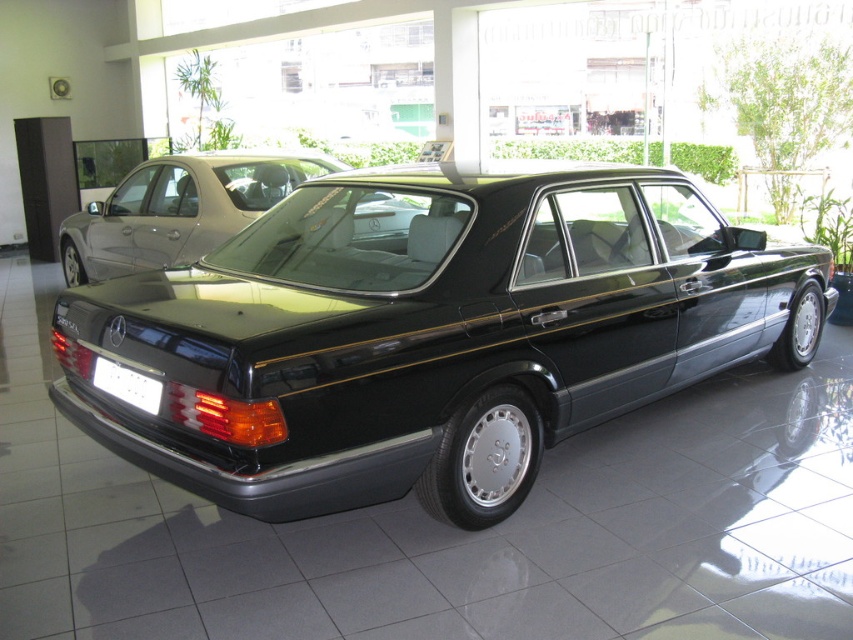
Is point (165, 323) closer to camera compared to point (62, 256)?

Yes, it is in front of point (62, 256).

Looking at this image, between glossy black car at center and glossy black sedan at center, which one has less height?

Standing shorter between the two is glossy black sedan at center.

At what (x,y) coordinates should I click in order to perform the action: click on glossy black car at center. Please return your answer as a coordinate pair (x, y). Image resolution: width=853 pixels, height=640 pixels. Looking at the image, I should click on (428, 332).

Does glossy black car at center have a lesser width compared to white plastic license plate at rear?

In fact, glossy black car at center might be wider than white plastic license plate at rear.

Between point (778, 292) and point (155, 394), which one is positioned in front?

Point (155, 394) is in front.

Locate an element on the screen. This screenshot has width=853, height=640. glossy black car at center is located at coordinates [x=428, y=332].

Which of these two, glossy black sedan at center or white plastic license plate at rear, stands taller?

Standing taller between the two is glossy black sedan at center.

Image resolution: width=853 pixels, height=640 pixels. What are the coordinates of `glossy black sedan at center` in the screenshot? It's located at (180, 209).